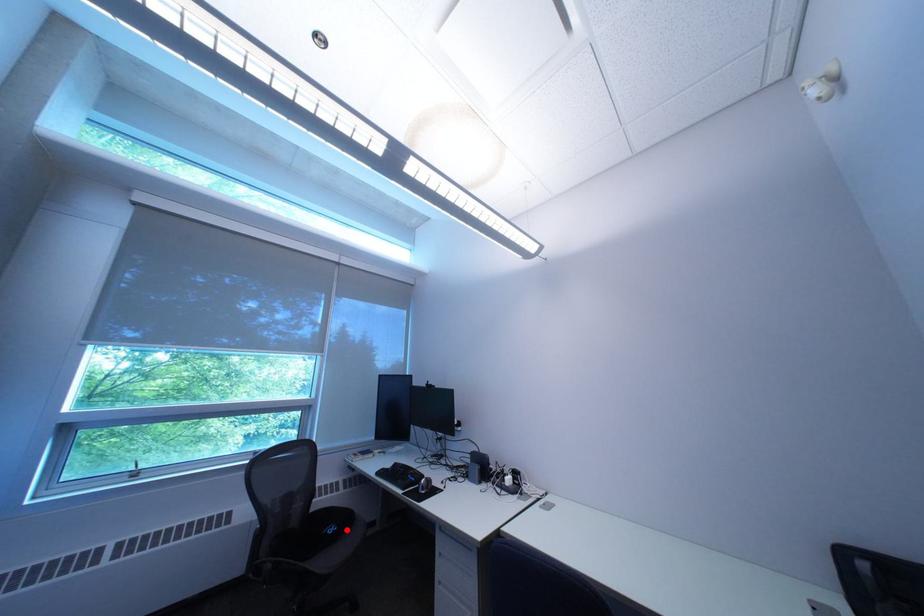
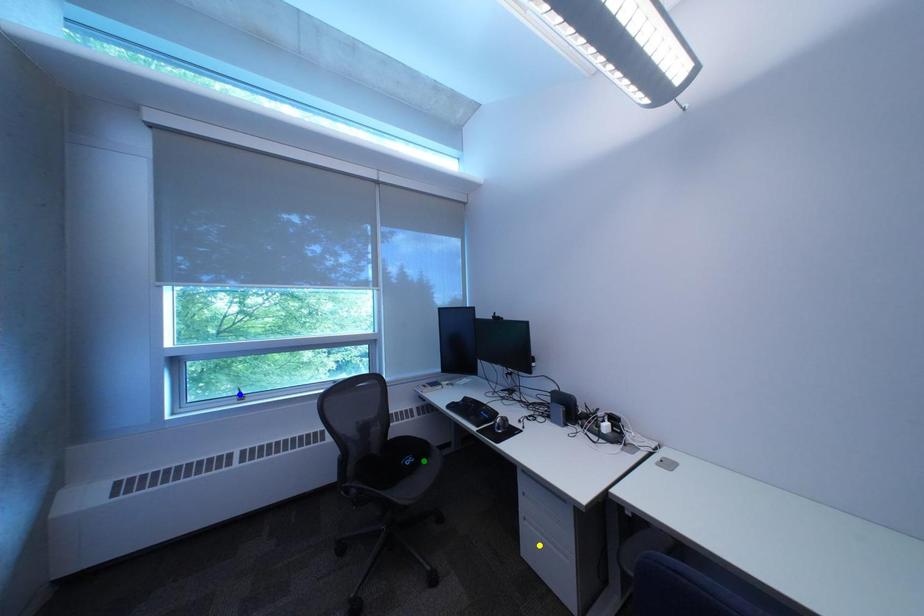
Question: I am providing you with two images of the same scene from different viewpoints. A red point is marked on the first image. You are given multiple points on the second image. Which point in image 2 is actually the same real-world point as the red point in image 1?

Choices:
 (A) green point
 (B) blue point
 (C) yellow point

Answer: (A)